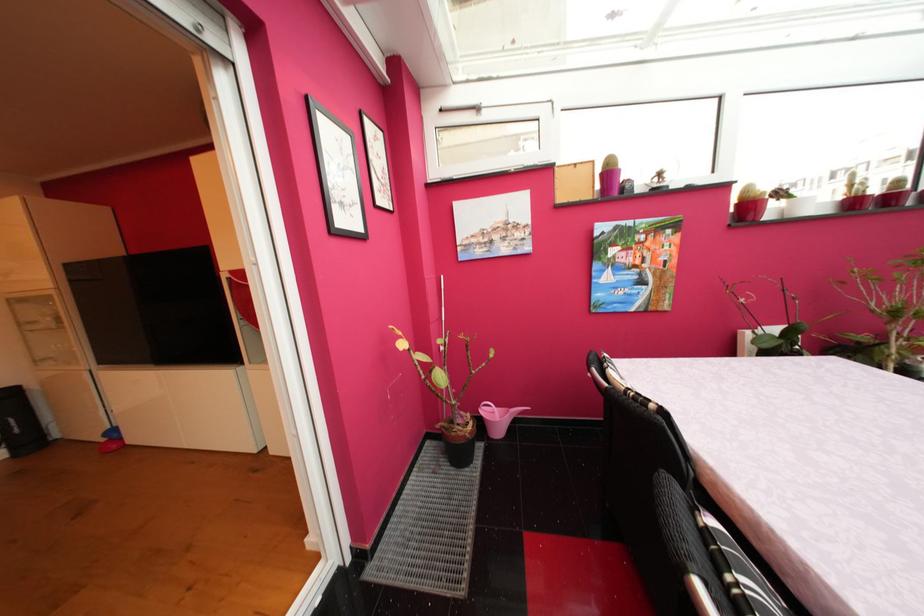
Where is `blue dustpan`? The height and width of the screenshot is (616, 924). blue dustpan is located at coordinates [497, 418].